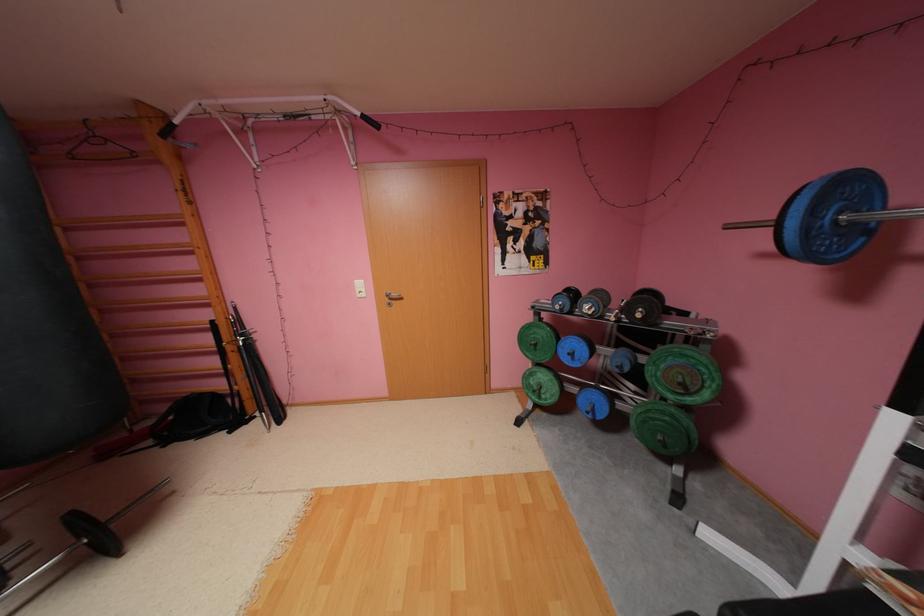
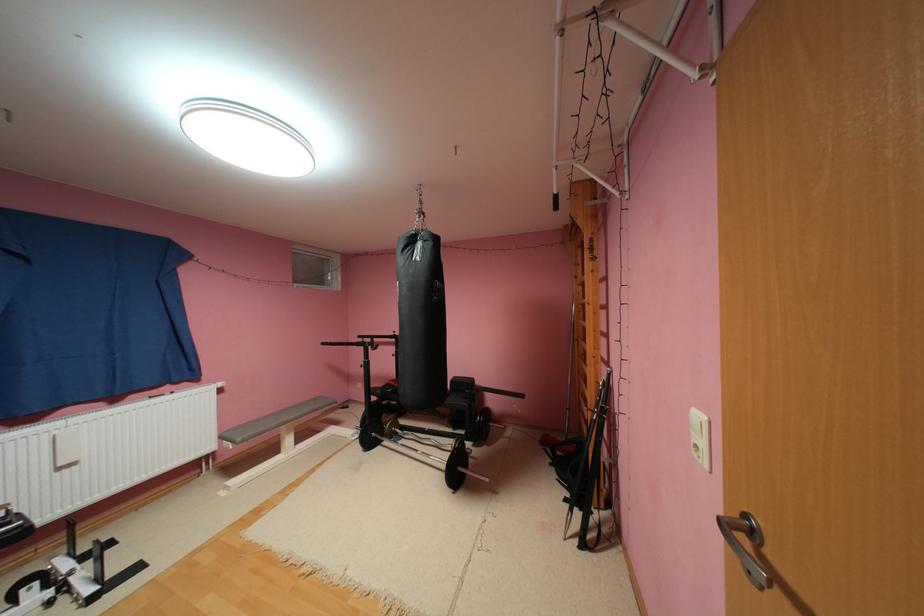
Locate, in the second image, the point that corresponds to pixel 238 432 in the first image.

(575, 500)